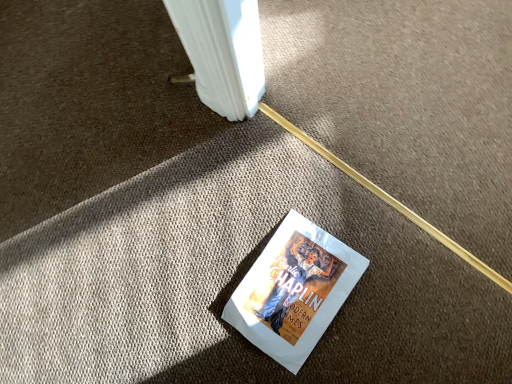
Find the location of a particular element. The height and width of the screenshot is (384, 512). vacant space behind white paper at center is located at coordinates (258, 193).